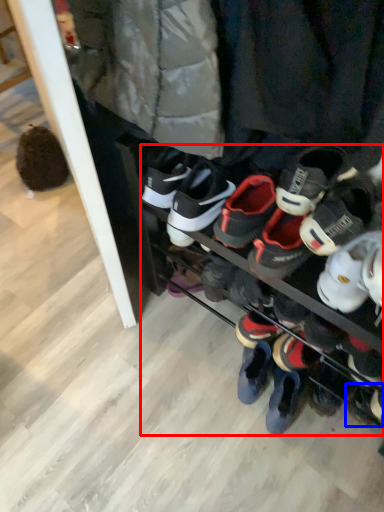
Question: Which point is closer to the camera, footwear (highlighted by a red box) or footwear (highlighted by a blue box)?

Choices:
 (A) footwear
 (B) footwear

Answer: (A)